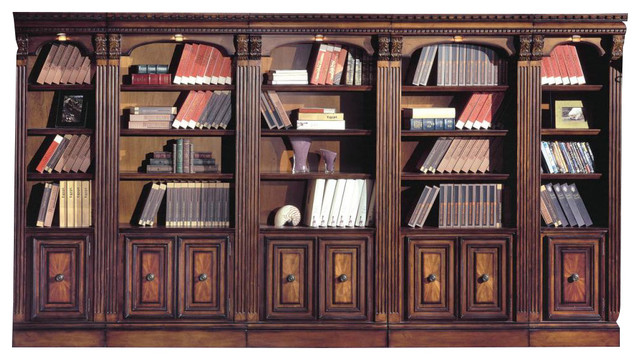
The height and width of the screenshot is (360, 640). In order to click on top shelf in this screenshot , I will do `click(61, 86)`, `click(172, 80)`, `click(323, 84)`, `click(474, 82)`, `click(570, 83)`.